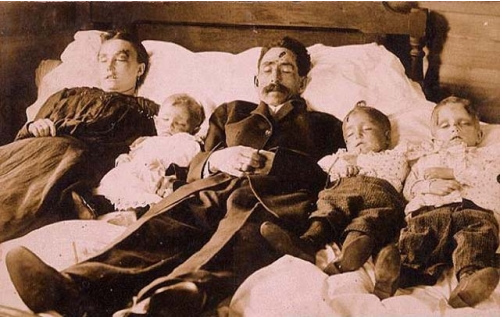
I want to click on children lying on the bed, so click(365, 166), click(451, 163), click(156, 152).